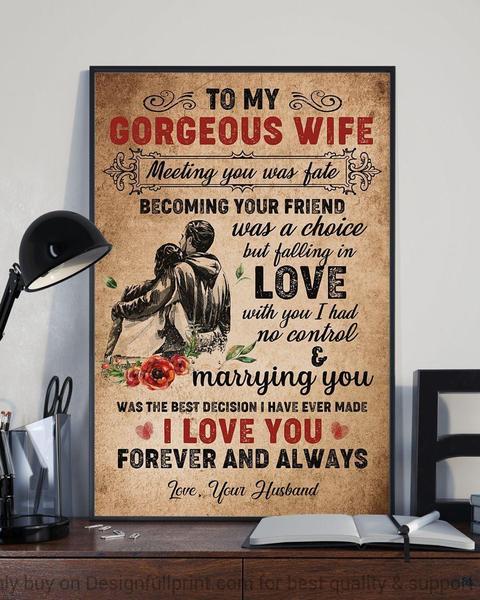
Locate an element on the screen. desk is located at coordinates (223, 547).